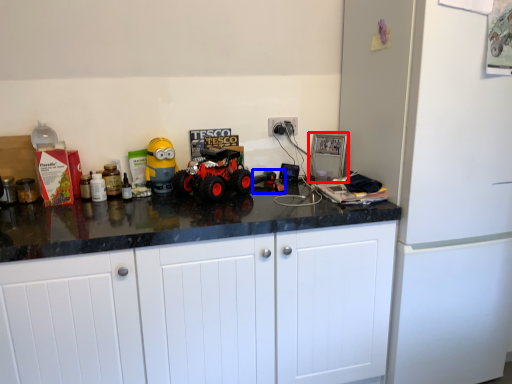
Question: Which point is further to the camera, appliance (highlighted by a red box) or toy (highlighted by a blue box)?

Choices:
 (A) appliance
 (B) toy

Answer: (A)